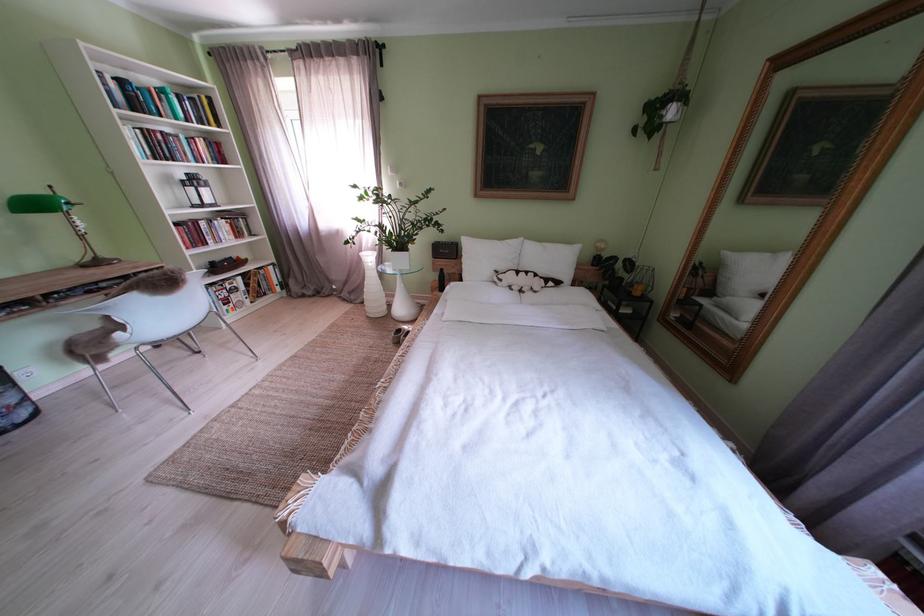
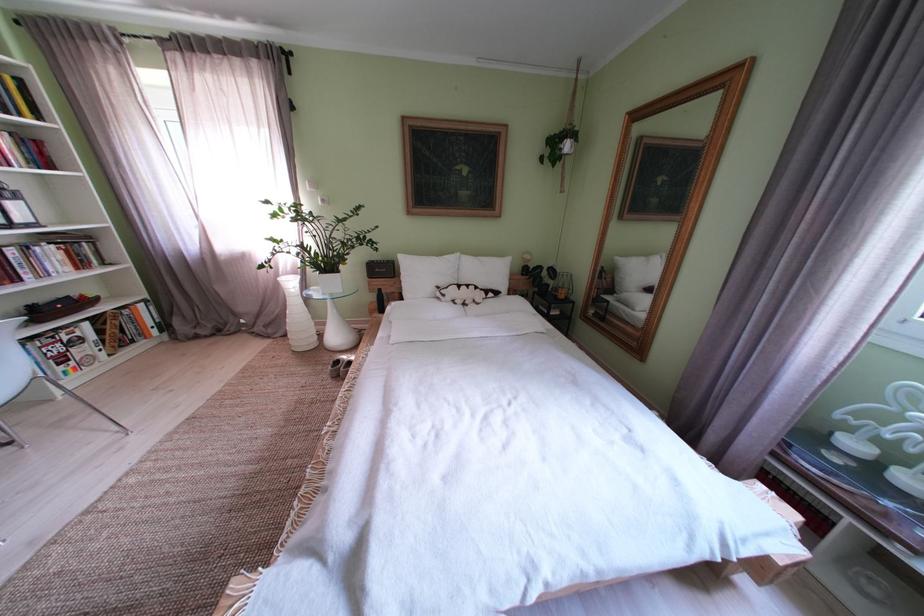
The point at [378,302] is marked in the first image. Where is the corresponding point in the second image?

(301, 334)